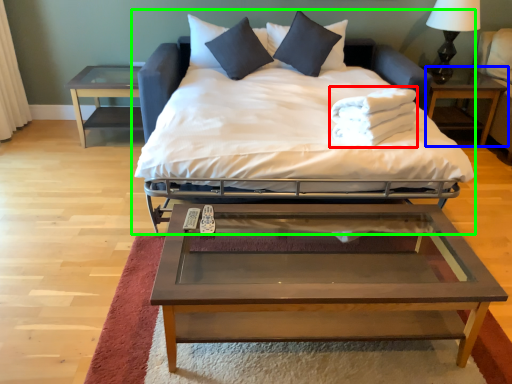
Question: Based on their relative distances, which object is farther from material (highlighted by a red box)? Choose from nightstand (highlighted by a blue box) and bed (highlighted by a green box).

Choices:
 (A) nightstand
 (B) bed

Answer: (A)